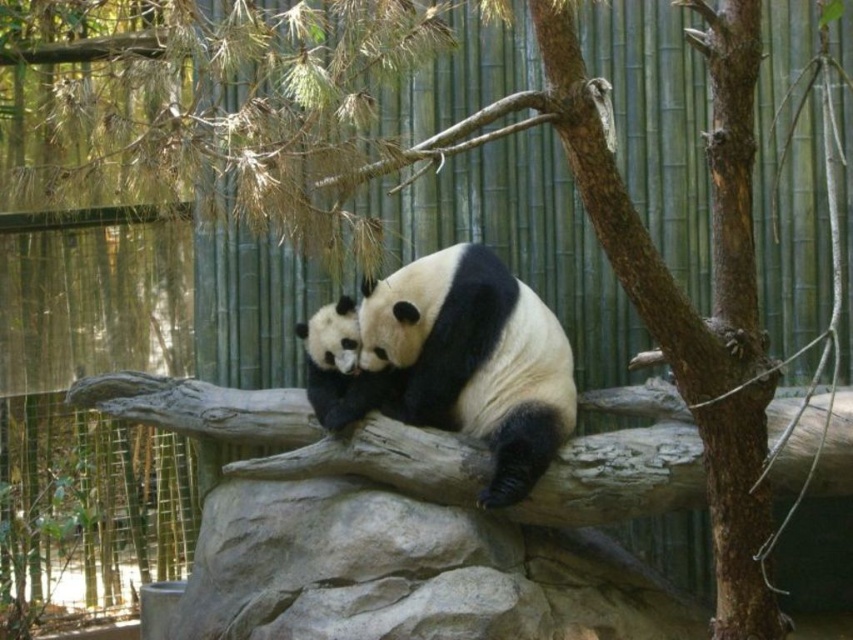
Question: Where is brown rough tree trunk at center right located in relation to black fuzzy panda at center in the image?

Choices:
 (A) above
 (B) below

Answer: (A)

Question: Which object is positioned farthest from the black fur panda at center?

Choices:
 (A) brown rough tree trunk at center right
 (B) black fuzzy panda at center

Answer: (A)

Question: Which object is closer to the camera taking this photo?

Choices:
 (A) black fur panda at center
 (B) brown rough tree trunk at center right
 (C) black fuzzy panda at center

Answer: (B)

Question: Which point is farther to the camera?

Choices:
 (A) black fur panda at center
 (B) black fuzzy panda at center

Answer: (B)

Question: Is black fur panda at center above black fuzzy panda at center?

Choices:
 (A) no
 (B) yes

Answer: (A)

Question: Can you confirm if black fur panda at center is thinner than black fuzzy panda at center?

Choices:
 (A) yes
 (B) no

Answer: (B)